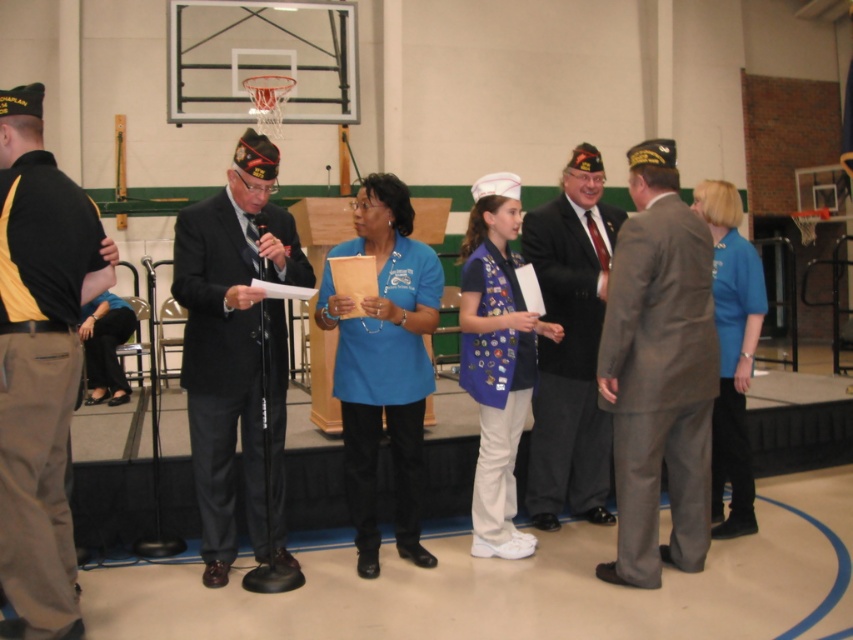
Question: Can you confirm if gray wool suit at center is positioned to the left of matte black suit at center?

Choices:
 (A) no
 (B) yes

Answer: (A)

Question: Considering the relative positions of blue fabric shirt at center and dark gray suit at center in the image provided, where is blue fabric shirt at center located with respect to dark gray suit at center?

Choices:
 (A) right
 (B) left

Answer: (B)

Question: Which point is closer to the camera taking this photo?

Choices:
 (A) (65, 509)
 (B) (273, 472)

Answer: (A)

Question: Which of the following is the closest to the observer?

Choices:
 (A) blue fabric shirt at center
 (B) blue fabric shirt at right
 (C) blue fabric vest at center

Answer: (A)

Question: Which object is the closest to the blue fabric shirt at center?

Choices:
 (A) black uniform at left
 (B) dark gray suit at center
 (C) gray wool suit at center
 (D) blue fabric vest at center

Answer: (D)

Question: Considering the relative positions of black uniform at left and dark gray suit at center in the image provided, where is black uniform at left located with respect to dark gray suit at center?

Choices:
 (A) left
 (B) right

Answer: (A)